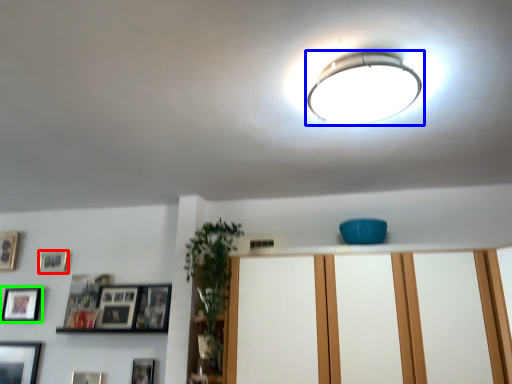
Question: Which object is the closest to the picture frame (highlighted by a red box)? Choose among these: lamp (highlighted by a blue box) or picture frame (highlighted by a green box).

Choices:
 (A) lamp
 (B) picture frame

Answer: (B)